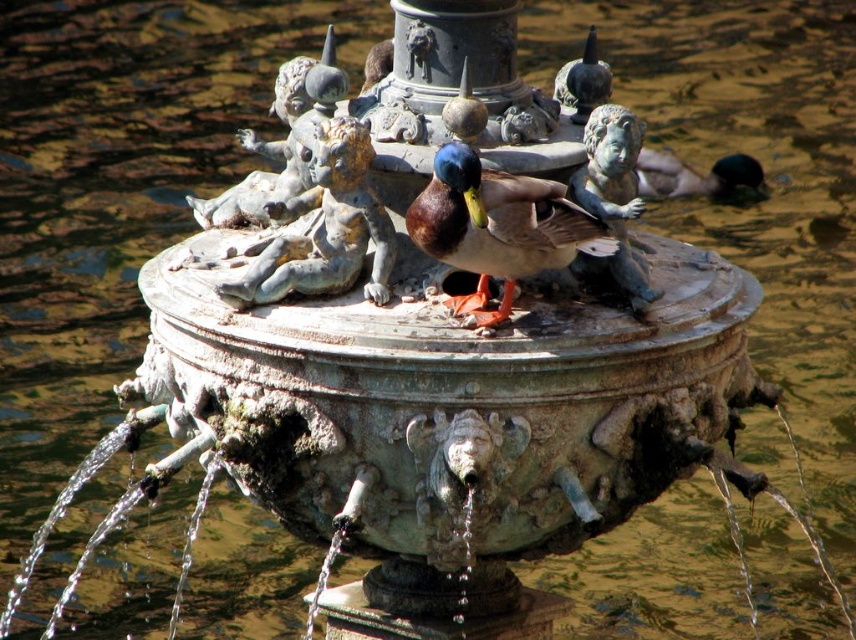
Question: Which point is closer to the camera?

Choices:
 (A) shiny green duck at right
 (B) bronze cherub at center
 (C) shiny brown duck at center

Answer: (C)

Question: Is blue-green stone cherub at center further to the viewer compared to shiny green duck at right?

Choices:
 (A) no
 (B) yes

Answer: (A)

Question: Which of the following is the farthest from the observer?

Choices:
 (A) bronze cherub at center
 (B) shiny brown duck at center

Answer: (A)

Question: Does bronze cherub at center lie in front of blue-green stone cherub at center?

Choices:
 (A) yes
 (B) no

Answer: (B)

Question: Does bronze cherub at center have a lesser width compared to blue-green stone cherub at center?

Choices:
 (A) yes
 (B) no

Answer: (B)

Question: Which of these objects is positioned farthest from the shiny green duck at right?

Choices:
 (A) bronze cherub at center
 (B) shiny brown duck at center

Answer: (A)